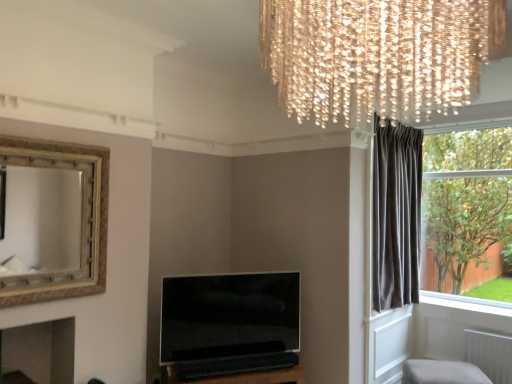
What is the approximate width of crystal chandelier at upper center?

crystal chandelier at upper center is 33.84 inches in width.

Locate an element on the screen. flat-screen tv at center is located at coordinates (229, 316).

You are a GUI agent. You are given a task and a screenshot of the screen. Output one action in this format:
    pyautogui.click(x=<x>, y=<y>)
    Task: Click on the dark velvet curtain at right
    
    Given the screenshot: What is the action you would take?
    pyautogui.click(x=396, y=214)

The image size is (512, 384). What are the coordinates of `television that is in front of the light beige fabric ottoman at lower right` in the screenshot? It's located at (229, 316).

Is light beige fabric ottoman at lower right to the right of flat-screen tv at center from the viewer's perspective?

Indeed, light beige fabric ottoman at lower right is positioned on the right side of flat-screen tv at center.

Does light beige fabric ottoman at lower right turn towards flat-screen tv at center?

No, light beige fabric ottoman at lower right is not oriented towards flat-screen tv at center.

Is light beige fabric ottoman at lower right touching flat-screen tv at center?

No, light beige fabric ottoman at lower right is not touching flat-screen tv at center.

In the scene shown: Is dark velvet curtain at right oriented away from light beige fabric ottoman at lower right?

That's not correct — dark velvet curtain at right is not looking away from light beige fabric ottoman at lower right.

Which of these two, dark velvet curtain at right or light beige fabric ottoman at lower right, is smaller?

Smaller between the two is light beige fabric ottoman at lower right.

Is dark velvet curtain at right positioned before light beige fabric ottoman at lower right?

No, it is not.

Is flat-screen tv at center completely or partially outside of crystal chandelier at upper center?

flat-screen tv at center lies outside crystal chandelier at upper center's area.

Is flat-screen tv at center in front of crystal chandelier at upper center?

No, flat-screen tv at center is further to the viewer.

What's the angular difference between flat-screen tv at center and crystal chandelier at upper center's facing directions?

The facing directions of flat-screen tv at center and crystal chandelier at upper center are 120 degrees apart.

Is point (245, 310) farther from viewer compared to point (267, 42)?

That is True.

How much distance is there between crystal chandelier at upper center and flat-screen tv at center?

The distance of crystal chandelier at upper center from flat-screen tv at center is 8.25 feet.

How different are the orientations of crystal chandelier at upper center and flat-screen tv at center in degrees?

The facing directions of crystal chandelier at upper center and flat-screen tv at center are 120 degrees apart.

Is crystal chandelier at upper center at the left side of flat-screen tv at center?

Incorrect, crystal chandelier at upper center is not on the left side of flat-screen tv at center.

From the image's perspective, is crystal chandelier at upper center on flat-screen tv at center?

Correct, crystal chandelier at upper center appears higher than flat-screen tv at center in the image.

Is dark velvet curtain at right placed right next to flat-screen tv at center?

No, dark velvet curtain at right is not touching flat-screen tv at center.

Is dark velvet curtain at right surrounding flat-screen tv at center?

Actually, flat-screen tv at center is outside dark velvet curtain at right.

Is dark velvet curtain at right oriented towards flat-screen tv at center?

No, dark velvet curtain at right is not aimed at flat-screen tv at center.

Based on the photo, can you confirm if dark velvet curtain at right is positioned to the right of flat-screen tv at center?

Yes, dark velvet curtain at right is to the right of flat-screen tv at center.

How distant is light beige fabric ottoman at lower right from crystal chandelier at upper center?

light beige fabric ottoman at lower right and crystal chandelier at upper center are 11.05 feet apart from each other.

Does light beige fabric ottoman at lower right have a greater width compared to crystal chandelier at upper center?

No.

Which is in front, point (451, 369) or point (428, 88)?

The point (428, 88) is closer to the camera.

Does light beige fabric ottoman at lower right lie behind crystal chandelier at upper center?

Yes, light beige fabric ottoman at lower right is further from the viewer.

Is gold textured mirror at upper left in contact with dark velvet curtain at right?

No, gold textured mirror at upper left is not next to dark velvet curtain at right.

Does gold textured mirror at upper left have a smaller size compared to dark velvet curtain at right?

Indeed, gold textured mirror at upper left has a smaller size compared to dark velvet curtain at right.

Between gold textured mirror at upper left and dark velvet curtain at right, which one appears on the right side from the viewer's perspective?

Positioned to the right is dark velvet curtain at right.

Is point (73, 166) closer or farther from the camera than point (387, 297)?

Point (73, 166) is positioned closer to the camera compared to point (387, 297).

You are a GUI agent. You are given a task and a screenshot of the screen. Output one action in this format:
    pyautogui.click(x=<x>, y=<y>)
    Task: Click on the furniture located on the right of flat-screen tv at center
    
    Given the screenshot: What is the action you would take?
    pyautogui.click(x=442, y=372)

At what (x,y) coordinates should I click in order to perform the action: click on curtain above the light beige fabric ottoman at lower right (from a real-world perspective). Please return your answer as a coordinate pair (x, y). This screenshot has height=384, width=512. Looking at the image, I should click on (396, 214).

When comparing their distances from gold textured mirror at upper left, does light beige fabric ottoman at lower right or flat-screen tv at center seem closer?

flat-screen tv at center is positioned closer to the anchor gold textured mirror at upper left.

Based on their spatial positions, is light beige fabric ottoman at lower right or flat-screen tv at center closer to dark velvet curtain at right?

light beige fabric ottoman at lower right lies closer to dark velvet curtain at right than the other object.

Based on their spatial positions, is gold textured mirror at upper left or flat-screen tv at center closer to crystal chandelier at upper center?

Based on the image, gold textured mirror at upper left appears to be nearer to crystal chandelier at upper center.

Looking at the image, which one is located closer to dark velvet curtain at right, gold textured mirror at upper left or flat-screen tv at center?

Based on the image, flat-screen tv at center appears to be nearer to dark velvet curtain at right.

Which object lies further to the anchor point flat-screen tv at center, gold textured mirror at upper left or crystal chandelier at upper center?

Among the two, crystal chandelier at upper center is located further to flat-screen tv at center.

Looking at the image, which one is located further to crystal chandelier at upper center, light beige fabric ottoman at lower right or gold textured mirror at upper left?

Among the two, light beige fabric ottoman at lower right is located further to crystal chandelier at upper center.

When comparing their distances from gold textured mirror at upper left, does crystal chandelier at upper center or flat-screen tv at center seem closer?

flat-screen tv at center is positioned closer to the anchor gold textured mirror at upper left.

Which object lies further to the anchor point flat-screen tv at center, crystal chandelier at upper center or gold textured mirror at upper left?

crystal chandelier at upper center.

Where is `television between crystal chandelier at upper center and light beige fabric ottoman at lower right along the z-axis`? This screenshot has width=512, height=384. television between crystal chandelier at upper center and light beige fabric ottoman at lower right along the z-axis is located at coordinates (229, 316).

Locate an element on the screen. Image resolution: width=512 pixels, height=384 pixels. picture frame positioned between crystal chandelier at upper center and dark velvet curtain at right from near to far is located at coordinates (81, 220).

This screenshot has height=384, width=512. I want to click on curtain located between flat-screen tv at center and light beige fabric ottoman at lower right in the left-right direction, so click(396, 214).

Locate an element on the screen. This screenshot has width=512, height=384. television situated between gold textured mirror at upper left and light beige fabric ottoman at lower right from left to right is located at coordinates (229, 316).